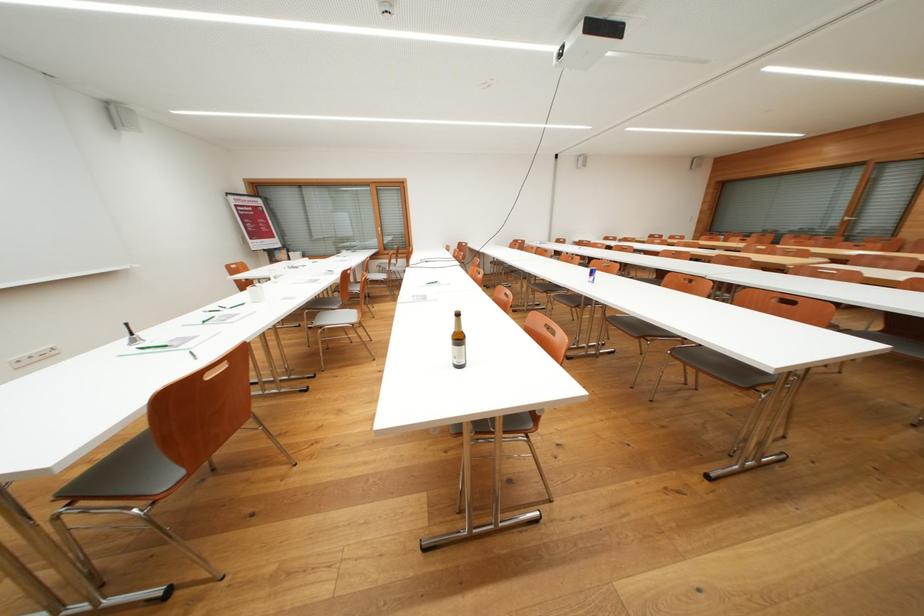
Where would you grasp the chair back handle? Please return your answer as a coordinate pair (x, y).

(162, 454)